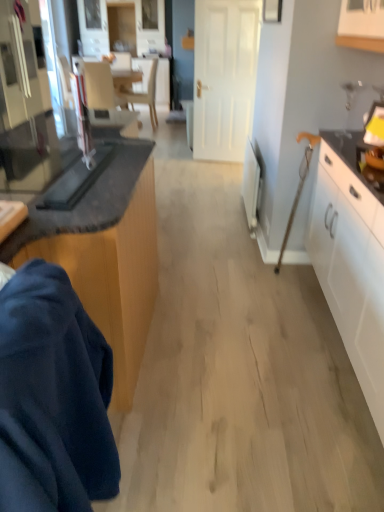
Identify the location of white matte door at center. (224, 77).

In order to face dark blue fabric at lower left, should I rotate leftwards or rightwards?

A 24.457 degree turn to the left will do.

Describe the element at coordinates (106, 100) in the screenshot. The width and height of the screenshot is (384, 512). I see `matte gray armchair at upper left` at that location.

Measure the distance between white plastic radiator at right, the 2th appliance from the front, and camera.

A distance of 3.04 meters exists between white plastic radiator at right, the 2th appliance from the front, and camera.

Image resolution: width=384 pixels, height=512 pixels. What are the coordinates of `white plastic radiator at right, which is the first appliance from right to left` in the screenshot? It's located at (252, 185).

Locate an element on the screen. This screenshot has width=384, height=512. black glass toaster at left, the second appliance in the back-to-front sequence is located at coordinates (77, 180).

What do you see at coordinates (145, 94) in the screenshot?
I see `light beige wood chair at upper center` at bounding box center [145, 94].

Locate an element on the screen. The width and height of the screenshot is (384, 512). white matte door at center is located at coordinates (224, 77).

The height and width of the screenshot is (512, 384). What are the coordinates of `cabinetry to the left of dark blue fabric at lower left` in the screenshot? It's located at (105, 253).

From the image's perspective, is dark blue fabric at lower left on wooden cabinet at lower left, positioned as the first cabinetry in left-to-right order?

No, from the image's perspective, dark blue fabric at lower left is not over wooden cabinet at lower left, positioned as the first cabinetry in left-to-right order.

Which is behind, dark blue fabric at lower left or wooden cabinet at lower left, which appears as the 2th cabinetry when viewed from the right?

wooden cabinet at lower left, which appears as the 2th cabinetry when viewed from the right, is more distant.

Which of these two, dark blue fabric at lower left or wooden cabinet at lower left, positioned as the first cabinetry in left-to-right order, is smaller?

dark blue fabric at lower left.

Is matte gray armchair at upper left behind wooden cabinet at lower left, which appears as the 2th cabinetry when viewed from the right?

That is True.

Which is more to the left, matte gray armchair at upper left or wooden cabinet at lower left, which appears as the 2th cabinetry when viewed from the right?

From the viewer's perspective, matte gray armchair at upper left appears more on the left side.

Consider the image. Does matte gray armchair at upper left have a lesser width compared to wooden cabinet at lower left, positioned as the first cabinetry in left-to-right order?

Correct, the width of matte gray armchair at upper left is less than that of wooden cabinet at lower left, positioned as the first cabinetry in left-to-right order.

Which object is closer to the camera taking this photo, white glossy cabinet at right, which is counted as the 1th cabinetry, starting from the right, or wooden cabinet at lower left, positioned as the first cabinetry in left-to-right order?

white glossy cabinet at right, which is counted as the 1th cabinetry, starting from the right, is closer to the camera.

Considering the sizes of objects white glossy cabinet at right, which is counted as the 1th cabinetry, starting from the right, and wooden cabinet at lower left, which appears as the 2th cabinetry when viewed from the right, in the image provided, who is shorter, white glossy cabinet at right, which is counted as the 1th cabinetry, starting from the right, or wooden cabinet at lower left, which appears as the 2th cabinetry when viewed from the right,?

Standing shorter between the two is wooden cabinet at lower left, which appears as the 2th cabinetry when viewed from the right.

Does white glossy cabinet at right, which is counted as the second cabinetry, starting from the left, turn towards wooden cabinet at lower left, which appears as the 2th cabinetry when viewed from the right?

Yes, white glossy cabinet at right, which is counted as the second cabinetry, starting from the left, is oriented towards wooden cabinet at lower left, which appears as the 2th cabinetry when viewed from the right.

Does point (382, 323) appear closer or farther from the camera than point (122, 173)?

Point (382, 323) is positioned closer to the camera compared to point (122, 173).

Locate an element on the screen. appliance below the dark blue fabric at lower left (from a real-world perspective) is located at coordinates (252, 185).

Between white plastic radiator at right, which is the first appliance in back-to-front order, and dark blue fabric at lower left, which one has smaller width?

Thinner between the two is white plastic radiator at right, which is the first appliance in back-to-front order.

Who is taller, white plastic radiator at right, which is the first appliance from right to left, or dark blue fabric at lower left?

With more height is dark blue fabric at lower left.

Which object is more forward, wooden cabinet at lower left, which appears as the 2th cabinetry when viewed from the right, or light beige wood chair at upper center?

wooden cabinet at lower left, which appears as the 2th cabinetry when viewed from the right, is more forward.

Identify the location of chair above the wooden cabinet at lower left, positioned as the first cabinetry in left-to-right order (from a real-world perspective). The height and width of the screenshot is (512, 384). (145, 94).

Could you tell me if wooden cabinet at lower left, which appears as the 2th cabinetry when viewed from the right, is facing light beige wood chair at upper center?

No.

Is there a large distance between wooden cabinet at lower left, which appears as the 2th cabinetry when viewed from the right, and light beige wood chair at upper center?

That's right, there is a large distance between wooden cabinet at lower left, which appears as the 2th cabinetry when viewed from the right, and light beige wood chair at upper center.

In the scene shown: Is matte gray armchair at upper left taller or shorter than dark blue fabric at lower left?

Clearly, matte gray armchair at upper left is taller compared to dark blue fabric at lower left.

You are a GUI agent. You are given a task and a screenshot of the screen. Output one action in this format:
    pyautogui.click(x=<x>, y=<y>)
    Task: Click on the armchair above the dark blue fabric at lower left (from a real-world perspective)
    This screenshot has height=512, width=384.
    Given the screenshot: What is the action you would take?
    pyautogui.click(x=106, y=100)

From a real-world perspective, which object stands above the other?

From a 3D spatial view, matte gray armchair at upper left is above.

From the image's perspective, would you say matte gray armchair at upper left is shown under dark blue fabric at lower left?

Incorrect, from the image's perspective, matte gray armchair at upper left is higher than dark blue fabric at lower left.

From the image's perspective, which object appears higher, white glossy cabinet at right, which is counted as the 1th cabinetry, starting from the right, or dark blue fabric at lower left?

white glossy cabinet at right, which is counted as the 1th cabinetry, starting from the right, from the image's perspective.

The image size is (384, 512). Find the location of `the 1st cabinetry above when counting from the dark blue fabric at lower left (from the image's perspective)`. the 1st cabinetry above when counting from the dark blue fabric at lower left (from the image's perspective) is located at coordinates (351, 269).

Based on the photo, in terms of width, does white glossy cabinet at right, which is counted as the second cabinetry, starting from the left, look wider or thinner when compared to dark blue fabric at lower left?

In the image, white glossy cabinet at right, which is counted as the second cabinetry, starting from the left, appears to be wider than dark blue fabric at lower left.

This screenshot has width=384, height=512. What are the coordinates of `robe below the wooden cabinet at lower left, positioned as the first cabinetry in left-to-right order (from the image's perspective)` in the screenshot? It's located at (53, 397).

The width and height of the screenshot is (384, 512). I want to click on armchair located on the left of wooden cabinet at lower left, which appears as the 2th cabinetry when viewed from the right, so click(106, 100).

When comparing their distances from black glass toaster at left, which appears as the 2th appliance when viewed from the right, does light beige wood chair at upper center or white glossy cabinet at right, which is counted as the 1th cabinetry, starting from the right, seem further?

light beige wood chair at upper center.

From the image, which object appears to be farther from light beige wood chair at upper center, white matte door at center or dark blue fabric at lower left?

Based on the image, dark blue fabric at lower left appears to be further to light beige wood chair at upper center.

Based on their spatial positions, is white plastic radiator at right, the 2th appliance from the left, or matte gray armchair at upper left further from white glossy cabinet at right, which is counted as the second cabinetry, starting from the left?

Among the two, matte gray armchair at upper left is located further to white glossy cabinet at right, which is counted as the second cabinetry, starting from the left.

Considering their positions, is white matte door at center positioned closer to white glossy cabinet at right, which is counted as the 1th cabinetry, starting from the right, than white plastic radiator at right, which is the first appliance from right to left?

white plastic radiator at right, which is the first appliance from right to left, is closer to white glossy cabinet at right, which is counted as the 1th cabinetry, starting from the right.

Considering their positions, is white plastic radiator at right, which is the first appliance from right to left, positioned closer to white matte door at center than dark blue fabric at lower left?

white plastic radiator at right, which is the first appliance from right to left, is closer to white matte door at center.

When comparing their distances from matte gray armchair at upper left, does white plastic radiator at right, which is the first appliance in back-to-front order, or white glossy cabinet at right, which is counted as the 1th cabinetry, starting from the right, seem further?

white glossy cabinet at right, which is counted as the 1th cabinetry, starting from the right, is further to matte gray armchair at upper left.

Based on the photo, which object lies nearer to the anchor point light beige wood chair at upper center, matte gray armchair at upper left or white glossy cabinet at right, which is counted as the second cabinetry, starting from the left?

The object closer to light beige wood chair at upper center is matte gray armchair at upper left.

Estimate the real-world distances between objects in this image. Which object is further from black glass toaster at left, acting as the first appliance starting from the left, white matte door at center or light beige wood chair at upper center?

light beige wood chair at upper center is further to black glass toaster at left, acting as the first appliance starting from the left.

The width and height of the screenshot is (384, 512). What are the coordinates of `cabinetry located between white glossy cabinet at right, which is counted as the 1th cabinetry, starting from the right, and matte gray armchair at upper left in the depth direction` in the screenshot? It's located at (105, 253).

I want to click on appliance between wooden cabinet at lower left, which appears as the 2th cabinetry when viewed from the right, and white plastic radiator at right, the 2th appliance from the front, along the z-axis, so coord(77,180).

At what (x,y) coordinates should I click in order to perform the action: click on appliance positioned between black glass toaster at left, acting as the first appliance starting from the left, and light beige wood chair at upper center from near to far. Please return your answer as a coordinate pair (x, y). The image size is (384, 512). Looking at the image, I should click on (252, 185).

I want to click on appliance between black glass toaster at left, which appears as the 2th appliance when viewed from the right, and matte gray armchair at upper left in the front-back direction, so click(252, 185).